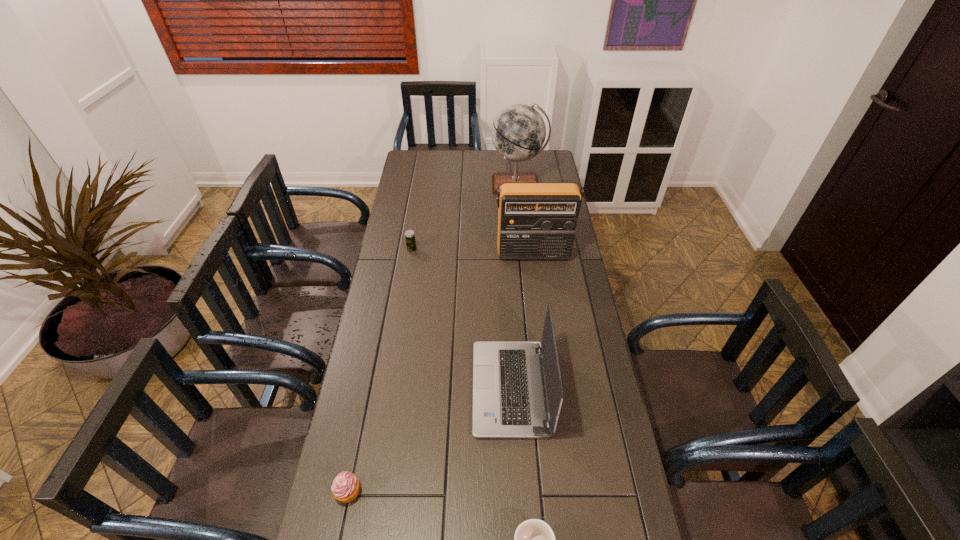
Where is `the tallest object`? The image size is (960, 540). the tallest object is located at coordinates (518, 132).

The width and height of the screenshot is (960, 540). Identify the location of globe. (518, 132).

I want to click on the second tallest object, so click(x=536, y=221).

You are a GUI agent. You are given a task and a screenshot of the screen. Output one action in this format:
    pyautogui.click(x=<x>, y=<y>)
    Task: Click on the fourth shortest object
    
    Given the screenshot: What is the action you would take?
    pyautogui.click(x=510, y=400)

At what (x,y) coordinates should I click in order to perform the action: click on the fourth farthest object. Please return your answer as a coordinate pair (x, y). Image resolution: width=960 pixels, height=540 pixels. Looking at the image, I should click on (510, 400).

The height and width of the screenshot is (540, 960). I want to click on beer can, so click(409, 234).

Locate an element on the screen. the leftmost object is located at coordinates (345, 488).

At what (x,y) coordinates should I click in order to perform the action: click on cupcake. Please return your answer as a coordinate pair (x, y). The height and width of the screenshot is (540, 960). Looking at the image, I should click on (345, 488).

Find the location of a particular element. This screenshot has height=540, width=960. vacant space located 0.230m at the equator of the globe is located at coordinates (522, 230).

The width and height of the screenshot is (960, 540). What are the coordinates of `free space located 0.300m on the front-facing side of the radio receiver` in the screenshot? It's located at (541, 321).